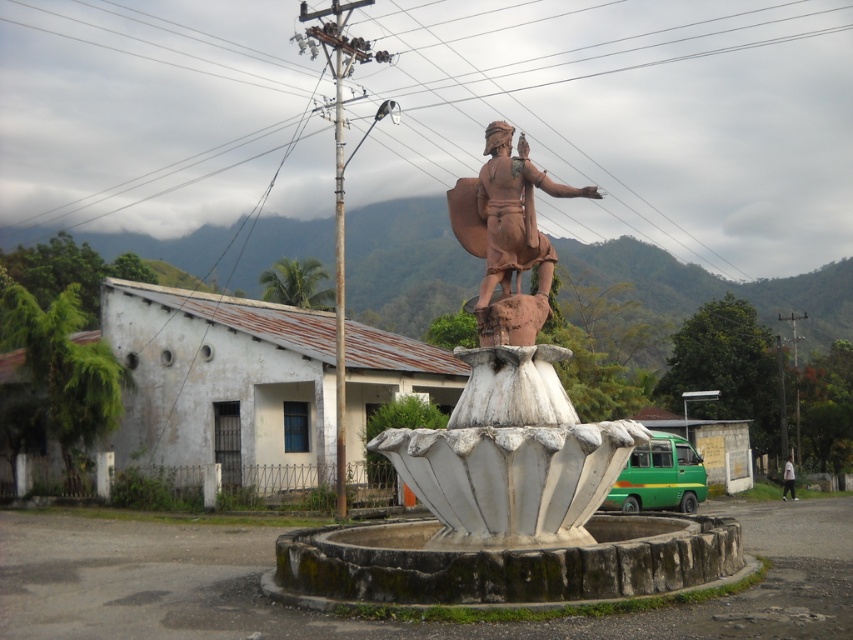
Question: Is rustic stone fountain at center bigger than brown clay statue at center?

Choices:
 (A) no
 (B) yes

Answer: (A)

Question: Which object is the farthest from the rustic stone fountain at center?

Choices:
 (A) brown clay statue at center
 (B) white fabric person at lower right

Answer: (B)

Question: Which object is closer to the camera taking this photo?

Choices:
 (A) brown clay statue at center
 (B) rustic stone fountain at center
 (C) white fabric person at lower right

Answer: (B)

Question: Can you confirm if rustic stone fountain at center is positioned above brown clay statue at center?

Choices:
 (A) yes
 (B) no

Answer: (B)

Question: Can you confirm if rustic stone fountain at center is positioned above brown clay statue at center?

Choices:
 (A) no
 (B) yes

Answer: (A)

Question: Which object is positioned farthest from the white fabric person at lower right?

Choices:
 (A) brown clay statue at center
 (B) rustic stone fountain at center

Answer: (B)